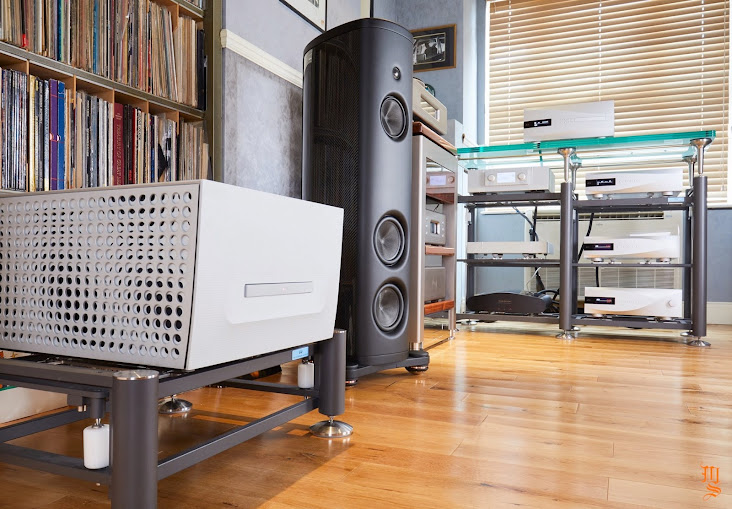
Locate an element on the screen. The image size is (732, 509). wall is located at coordinates (274, 135), (452, 81), (285, 50), (720, 246).